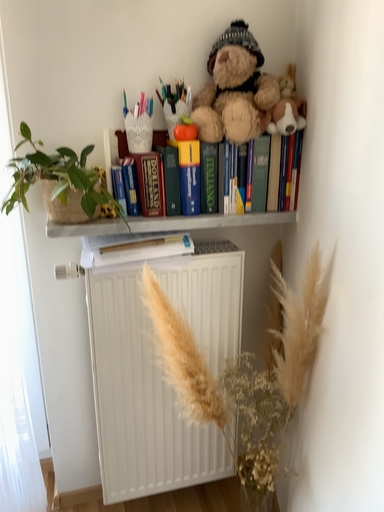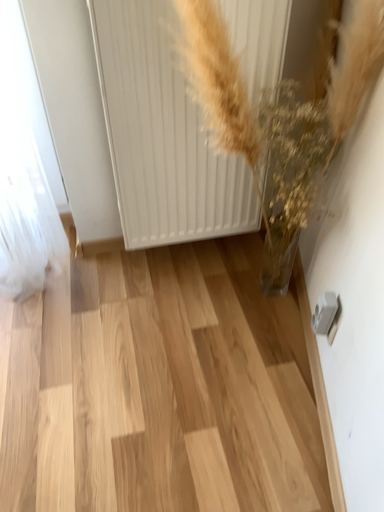
Question: How did the camera likely rotate when shooting the video?

Choices:
 (A) rotated upward
 (B) rotated downward

Answer: (B)